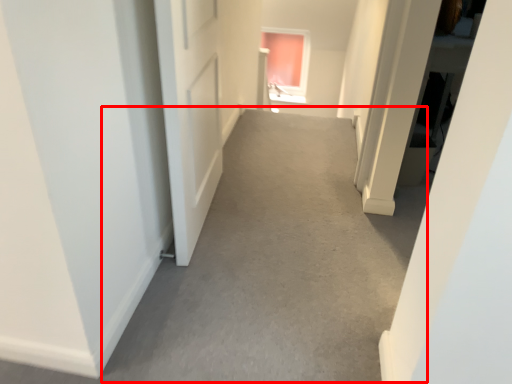
Question: Observing the image, what is the correct spatial positioning of alley (annotated by the red box) in reference to window?

Choices:
 (A) right
 (B) left

Answer: (B)